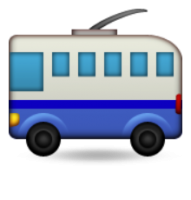
In order to click on light in this screenshot , I will do `click(16, 121)`.